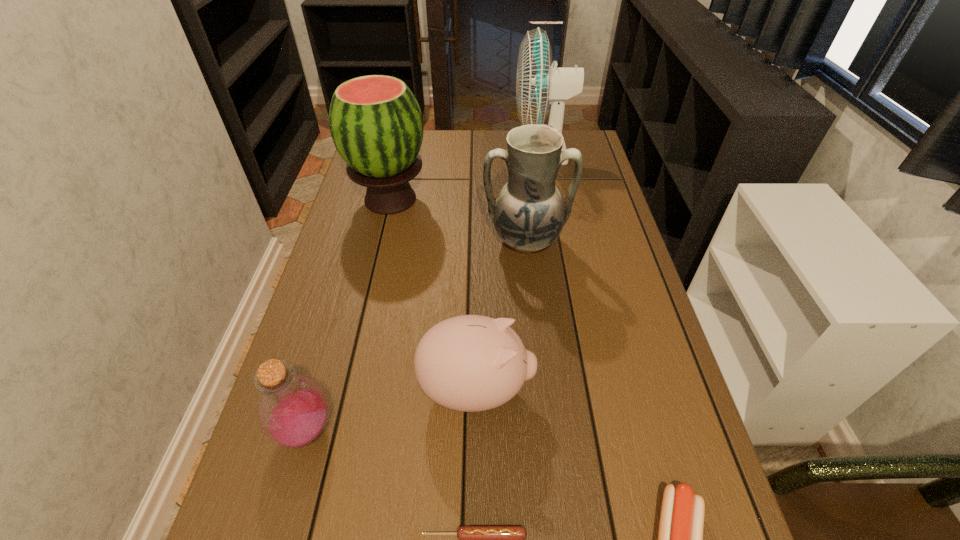
This screenshot has width=960, height=540. I want to click on fan, so [x=538, y=84].

Identify the location of watermelon. (375, 121).

Find the location of a particular element. Image resolution: width=960 pixels, height=540 pixels. pitcher is located at coordinates (529, 213).

Identify the location of bottle. (293, 410).

Identify the location of piggy bank. (470, 363).

I want to click on vacant space located 0.270m in front of the farthest object to face the airflow, so click(x=438, y=152).

Locate an element on the screen. The image size is (960, 540). free space located in front of the farthest object to face the airflow is located at coordinates (444, 152).

Locate an element on the screen. vacant space located 0.120m in front of the farthest object to face the airflow is located at coordinates (480, 152).

The image size is (960, 540). Identify the location of free space located on the right of the watermelon. (510, 199).

Locate an element on the screen. free space located on the front-facing side of the pitcher is located at coordinates (532, 298).